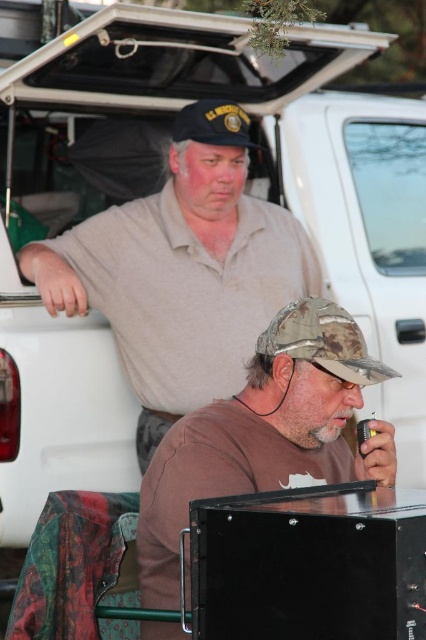
Question: Where is light brown cotton shirt at upper center located in relation to brown matte shirt at lower center in the image?

Choices:
 (A) below
 (B) above

Answer: (B)

Question: Where is light brown cotton shirt at upper center located in relation to brown matte shirt at lower center in the image?

Choices:
 (A) below
 (B) above

Answer: (B)

Question: Observing the image, what is the correct spatial positioning of light brown cotton shirt at upper center in reference to brown matte shirt at lower center?

Choices:
 (A) below
 (B) above

Answer: (B)

Question: Which of the following is the farthest from the observer?

Choices:
 (A) (249, 220)
 (B) (172, 636)

Answer: (A)

Question: Which of the following is the farthest from the observer?

Choices:
 (A) brown matte shirt at lower center
 (B) light brown cotton shirt at upper center

Answer: (B)